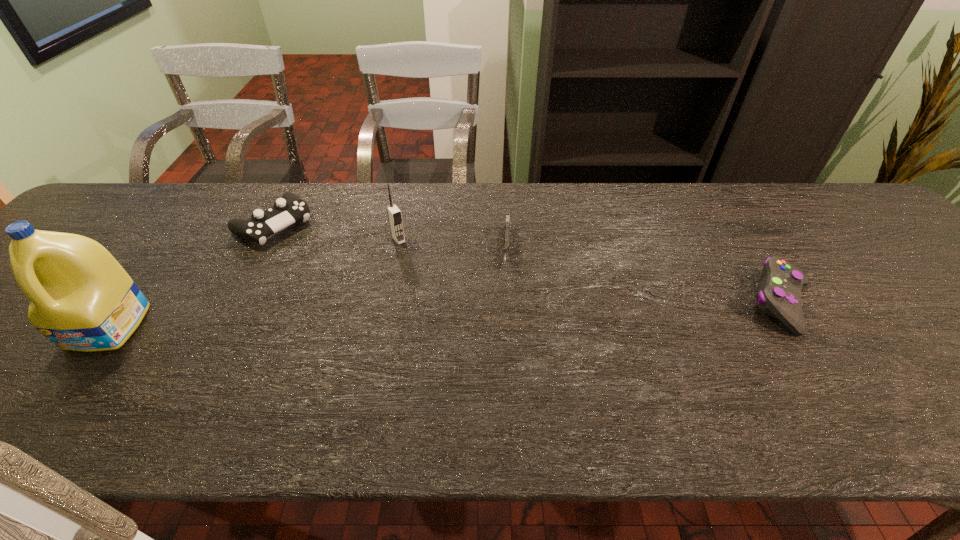
The height and width of the screenshot is (540, 960). Identify the location of unoccupied area between the farther control and the right control. (528, 264).

Identify the location of vacant area that lies between the fourth shortest object and the tallest object. Image resolution: width=960 pixels, height=540 pixels. (253, 283).

The height and width of the screenshot is (540, 960). In order to click on free point between the third object from left to right and the left control in this screenshot , I will do `click(336, 232)`.

Find the location of a particular element. The width and height of the screenshot is (960, 540). free space between the cellular telephone and the leftmost object is located at coordinates (253, 283).

Locate an element on the screen. This screenshot has width=960, height=540. vacant point located between the second object from right to left and the fourth shortest object is located at coordinates [x=453, y=244].

I want to click on object that is the third closest one to the gun, so click(x=779, y=295).

The width and height of the screenshot is (960, 540). Find the location of `object that stands as the second closest to the detergent`. object that stands as the second closest to the detergent is located at coordinates tap(394, 214).

Where is `free location that satisfies the following two spatial constraints: 1. on the front side of the third object from left to right; 2. on the left side of the farther control`? The width and height of the screenshot is (960, 540). free location that satisfies the following two spatial constraints: 1. on the front side of the third object from left to right; 2. on the left side of the farther control is located at coordinates (266, 239).